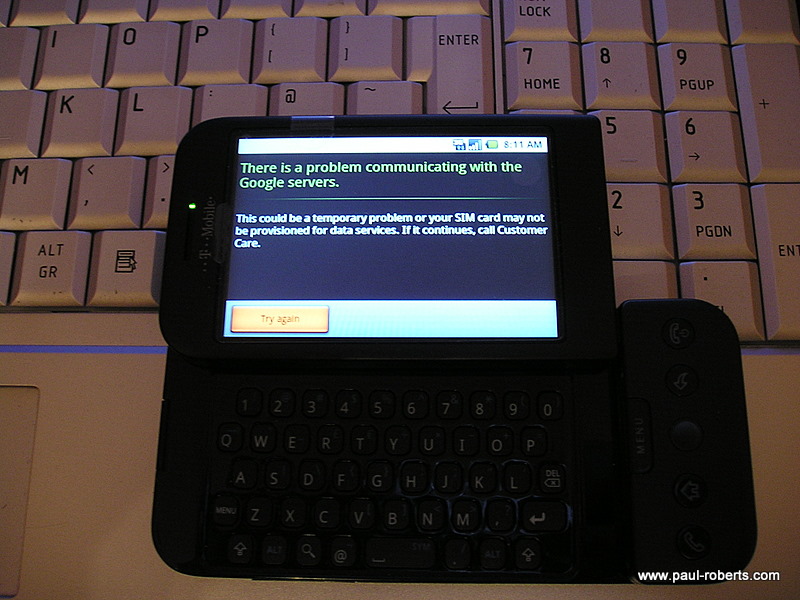
What are the coordinates of `laptop` in the screenshot? It's located at (101, 431).